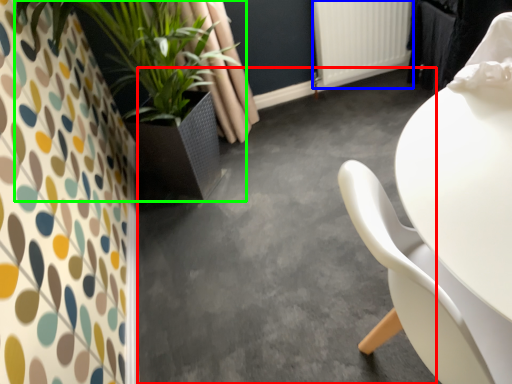
Question: Which is farther away from concrete (highlighted by a red box)? radiator (highlighted by a blue box) or houseplant (highlighted by a green box)?

Choices:
 (A) radiator
 (B) houseplant

Answer: (A)